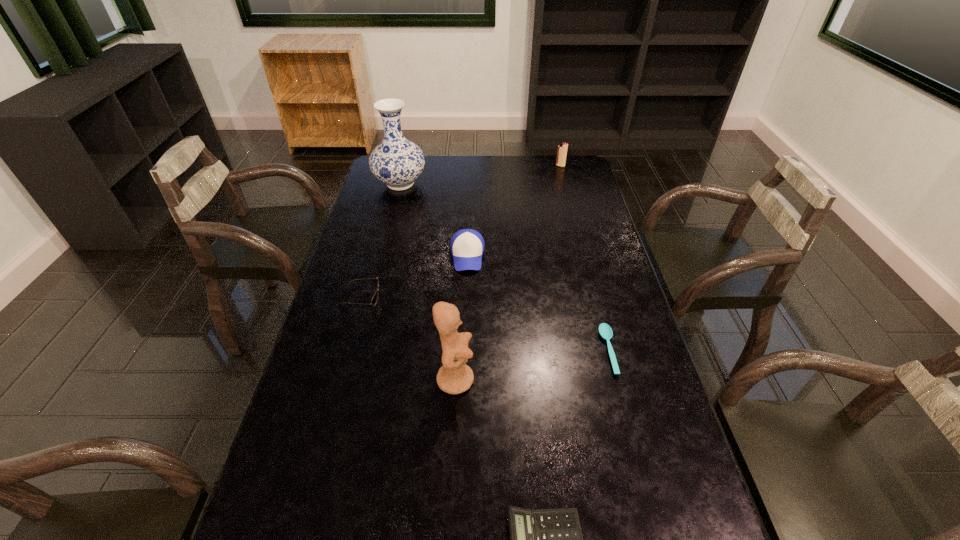
Locate an element on the screen. Image resolution: width=960 pixels, height=540 pixels. spoon at the right edge is located at coordinates (605, 330).

Locate an element on the screen. This screenshot has width=960, height=540. object positioned at the far left corner is located at coordinates (397, 162).

Locate an element on the screen. object at the far right corner is located at coordinates (562, 148).

At what (x,y) coordinates should I click in order to perform the action: click on free spot at the far edge of the desktop. Please return your answer as a coordinate pair (x, y). Looking at the image, I should click on (457, 168).

This screenshot has height=540, width=960. Find the location of `free location at the left edge of the desktop`. free location at the left edge of the desktop is located at coordinates (364, 338).

In the image, there is a desktop. Where is `blank space at the right edge`? The height and width of the screenshot is (540, 960). blank space at the right edge is located at coordinates (615, 426).

Locate an element on the screen. free spot between the baseball cap and the second farthest object is located at coordinates (434, 220).

Image resolution: width=960 pixels, height=540 pixels. I want to click on unoccupied area between the shortest object and the farthest object, so click(x=585, y=258).

Find the location of a particular element. The image size is (960, 540). empty space between the shortest object and the fourth farthest object is located at coordinates (485, 323).

I want to click on unoccupied position between the farthest object and the shortest object, so click(x=585, y=258).